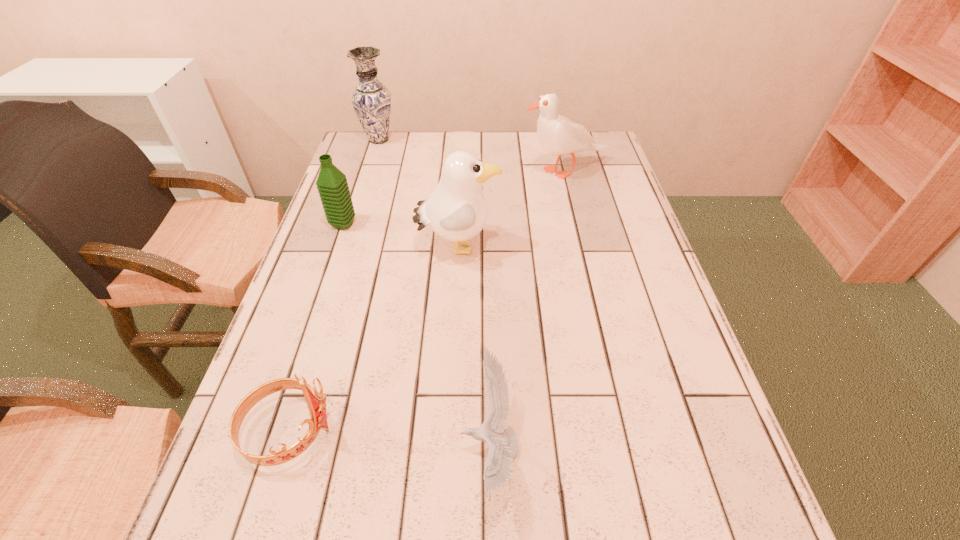
Locate an element on the screen. Image resolution: width=960 pixels, height=540 pixels. vacant space that's between the shortest object and the water bottle is located at coordinates (417, 335).

Locate an element on the screen. This screenshot has width=960, height=540. object that is the fifth closest to the second farthest gull is located at coordinates (x=371, y=100).

This screenshot has height=540, width=960. Identify the location of object that can be found as the second closest to the water bottle. (371, 100).

I want to click on gull that is the third closest to the vase, so click(503, 442).

Select which gull is the second closest to the farthest object. Please provide its 2D coordinates. Your answer should be formatted as a tuple, i.e. [(x, y)], where the tuple contains the x and y coordinates of a point satisfying the conditions above.

[(457, 210)]